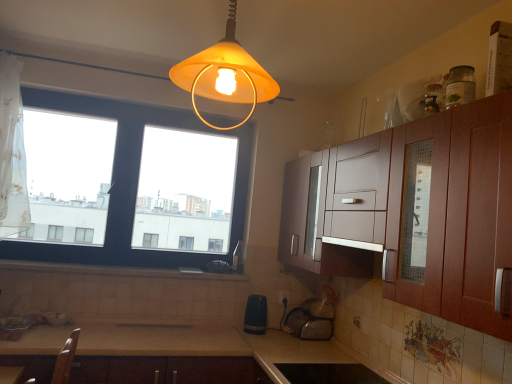
Where is `free point above white tile at lower center (from a real-world perspective)`? The height and width of the screenshot is (384, 512). free point above white tile at lower center (from a real-world perspective) is located at coordinates [x=119, y=266].